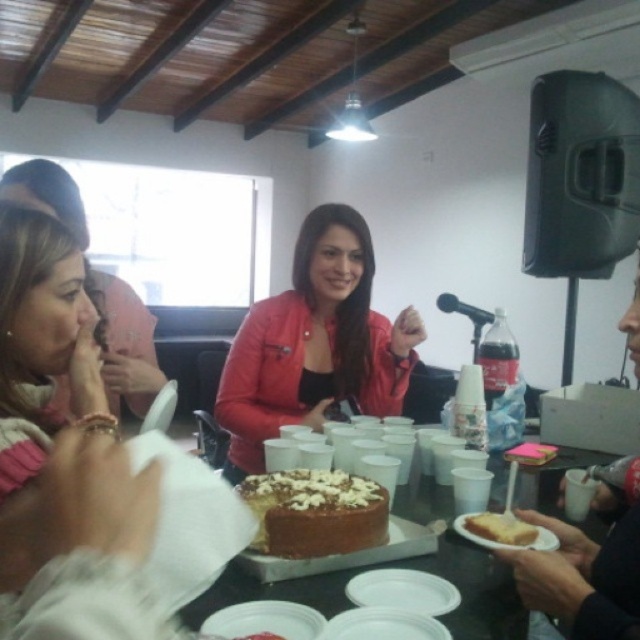
You are planning to place the black plastic microphone at upper right on the table where the chocolate frosted cake at center is located. Considering their sizes, will the microphone fit on the remaining space next to the cake?

The chocolate frosted cake at center is wider than the black plastic microphone at upper right, so there should be enough space to place the microphone next to it on the table.

What color is the object located at point (42,339)?

The object located at point (42,339) is matte pink.